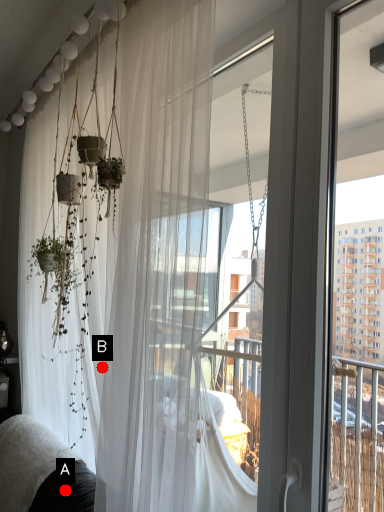
Question: Two points are circled on the image, labeled by A and B beside each circle. Which point is closer to the camera?

Choices:
 (A) A is closer
 (B) B is closer

Answer: (B)